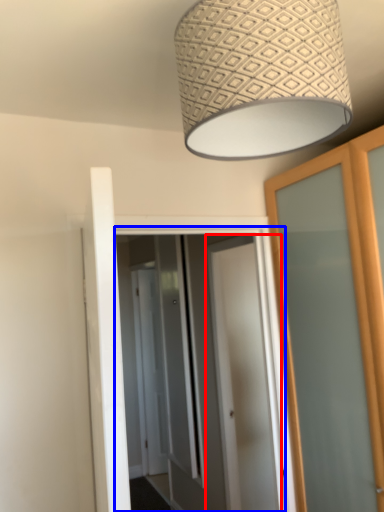
Question: Which of the following is the closest to the observer, door (highlighted by a red box) or screen door (highlighted by a blue box)?

Choices:
 (A) door
 (B) screen door

Answer: (B)